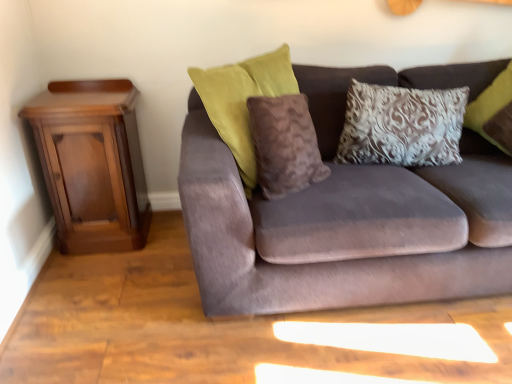
Question: Looking at their shapes, would you say brown fuzzy pillow at center, which ranks as the 1th pillow in left-to-right order, is wider or thinner than silver textured pillow at upper right, the 2th pillow from the left?

Choices:
 (A) thin
 (B) wide

Answer: (A)

Question: Would you say brown fuzzy pillow at center, which ranks as the 1th pillow in left-to-right order, is inside or outside silver textured pillow at upper right, the 2th pillow from the left?

Choices:
 (A) inside
 (B) outside

Answer: (B)

Question: Considering the real-world distances, which object is closest to the velvet brown couch at center?

Choices:
 (A) silver textured pillow at upper right, which is the first pillow from right to left
 (B) brown fuzzy pillow at center, which ranks as the 1th pillow in left-to-right order
 (C) mahogany wood nightstand at left

Answer: (B)

Question: Which is nearer to the velvet brown couch at center?

Choices:
 (A) brown fuzzy pillow at center, which ranks as the 1th pillow in left-to-right order
 (B) silver textured pillow at upper right, the 2th pillow from the left
 (C) mahogany wood nightstand at left

Answer: (A)